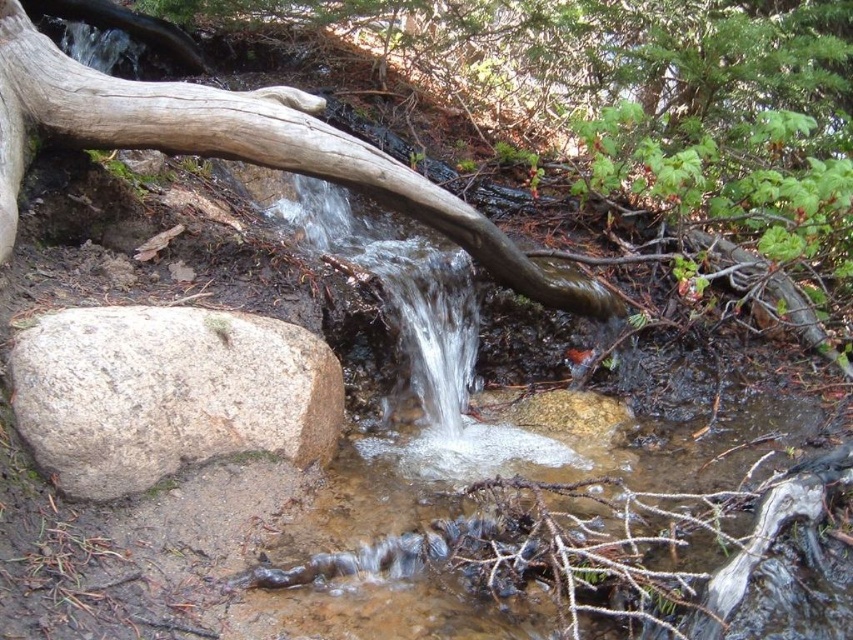
Is the position of gray rough rock at lower left more distant than that of smooth brown log at center?

That is False.

Does gray rough rock at lower left lie in front of smooth brown log at center?

Yes, it is in front of smooth brown log at center.

Is point (294, 406) positioned behind point (22, 125)?

Yes.

Where is `gray rough rock at lower left`? The image size is (853, 640). gray rough rock at lower left is located at coordinates (167, 394).